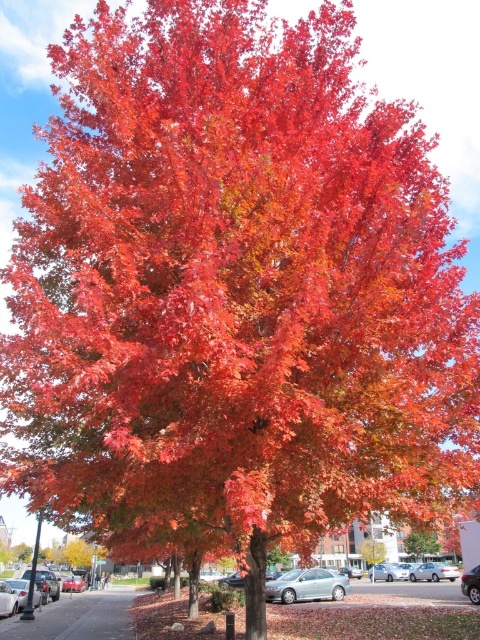
In the scene shown: Who is taller, shiny orange leaves at center or metallic silver car at center?

With more height is shiny orange leaves at center.

In the scene shown: Is shiny orange leaves at center to the right of metallic silver car at center from the viewer's perspective?

Correct, you'll find shiny orange leaves at center to the right of metallic silver car at center.

Find the location of a particular element. This screenshot has width=480, height=640. shiny orange leaves at center is located at coordinates (420, 544).

Between satin silver sedan at center and satin silver sedan at lower center, which one has less height?

satin silver sedan at lower center is shorter.

In order to click on satin silver sedan at center in this screenshot , I will do `click(307, 586)`.

Describe the element at coordinates (307, 586) in the screenshot. I see `satin silver sedan at center` at that location.

Find the location of a particular element. Image resolution: width=480 pixels, height=640 pixels. satin silver sedan at center is located at coordinates (307, 586).

Which is in front, point (412, 572) or point (71, 588)?

Point (412, 572)

Between point (451, 577) and point (83, 579), which one is positioned behind?

Point (83, 579)

The image size is (480, 640). Find the location of `satin silver sedan at lower center`. satin silver sedan at lower center is located at coordinates pos(433,572).